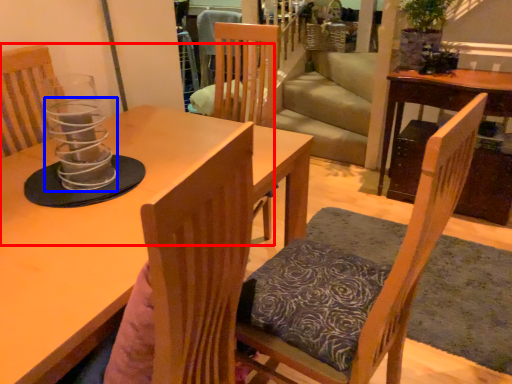
Question: Which object is closer to the camera taking this photo, chair (highlighted by a red box) or candle holder (highlighted by a blue box)?

Choices:
 (A) chair
 (B) candle holder

Answer: (B)